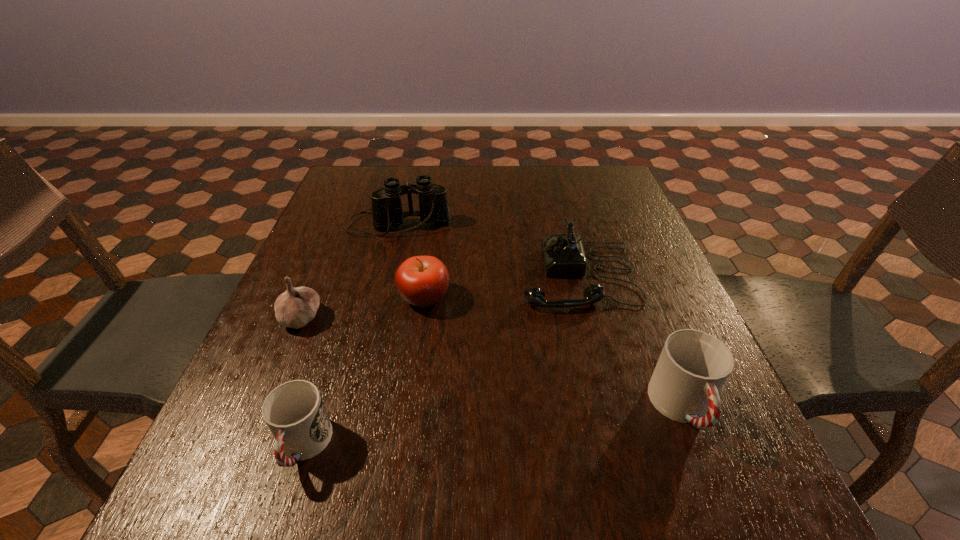
This screenshot has height=540, width=960. In order to click on vacant space located on the front of the garlic in this screenshot , I will do `click(271, 389)`.

Find the location of a particular element. blank space located 0.070m on the right of the apple is located at coordinates (482, 297).

Identify the location of cup that is at the left edge. (294, 412).

I want to click on binoculars at the left edge, so click(386, 208).

The width and height of the screenshot is (960, 540). Identify the location of garlic at the left edge. (297, 306).

Identify the location of cup that is at the right edge. The width and height of the screenshot is (960, 540). (693, 366).

Locate an element on the screen. The width and height of the screenshot is (960, 540). telephone at the right edge is located at coordinates (563, 254).

Locate an element on the screen. object at the near left corner is located at coordinates (294, 412).

What are the coordinates of `object at the near right corner` in the screenshot? It's located at (693, 366).

What are the coordinates of `free region at the far edge of the desktop` in the screenshot? It's located at (469, 203).